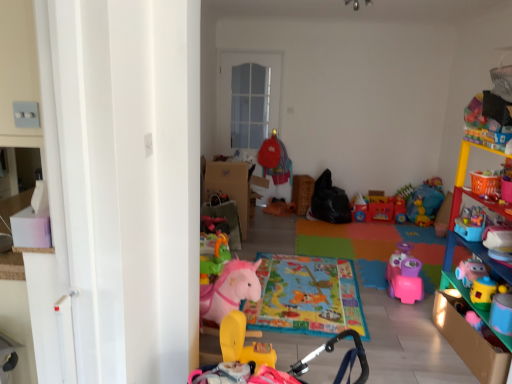
Question: Is rubber yellow rocking horse at lower center, the second toy from the back, bigger or smaller than rubber yellow horse at center, acting as the first toy starting from the back?

Choices:
 (A) big
 (B) small

Answer: (A)

Question: Would you say rubber yellow rocking horse at lower center, the second toy from the back, is to the left or to the right of rubber yellow horse at center, the 2th toy from the front, in the picture?

Choices:
 (A) left
 (B) right

Answer: (B)

Question: Estimate the real-world distances between objects in this image. Which object is farther from the multicolored plastic shelf at right?

Choices:
 (A) rubber yellow rocking horse at lower center, the 1th toy positioned from the front
 (B) rubber yellow horse at center, the 2th toy from the front

Answer: (B)

Question: Which is nearer to the rubber yellow rocking horse at lower center, the second toy from the back?

Choices:
 (A) rubber yellow horse at center, acting as the first toy starting from the back
 (B) multicolored plastic shelf at right

Answer: (A)